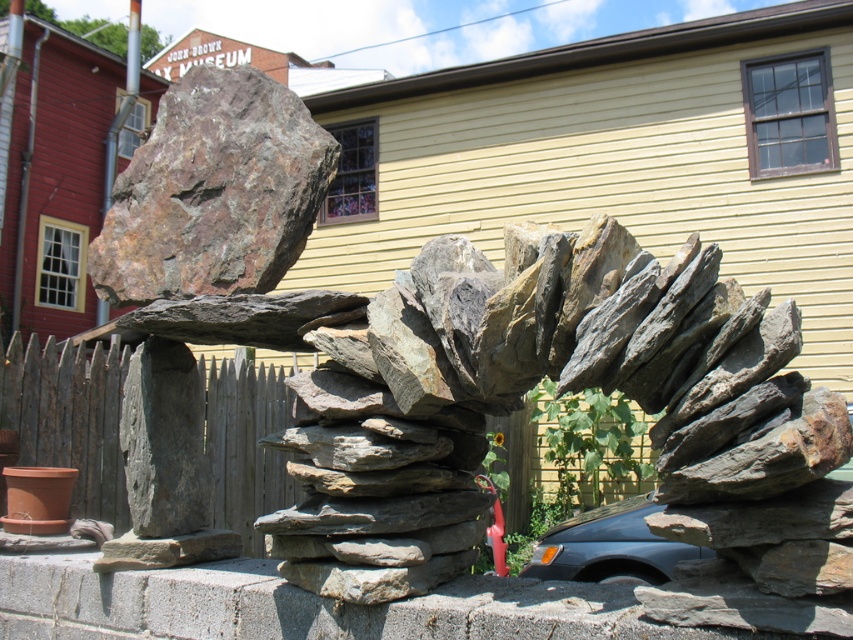
Is rusty metallic boulder at upper left bigger than wooden picket fence at left?

No, rusty metallic boulder at upper left is not bigger than wooden picket fence at left.

Between rusty metallic boulder at upper left and wooden picket fence at left, which one appears on the left side from the viewer's perspective?

wooden picket fence at left

Does point (200, 116) come behind point (212, 492)?

No, (200, 116) is in front of (212, 492).

Identify the location of rusty metallic boulder at upper left. Image resolution: width=853 pixels, height=640 pixels. tap(213, 192).